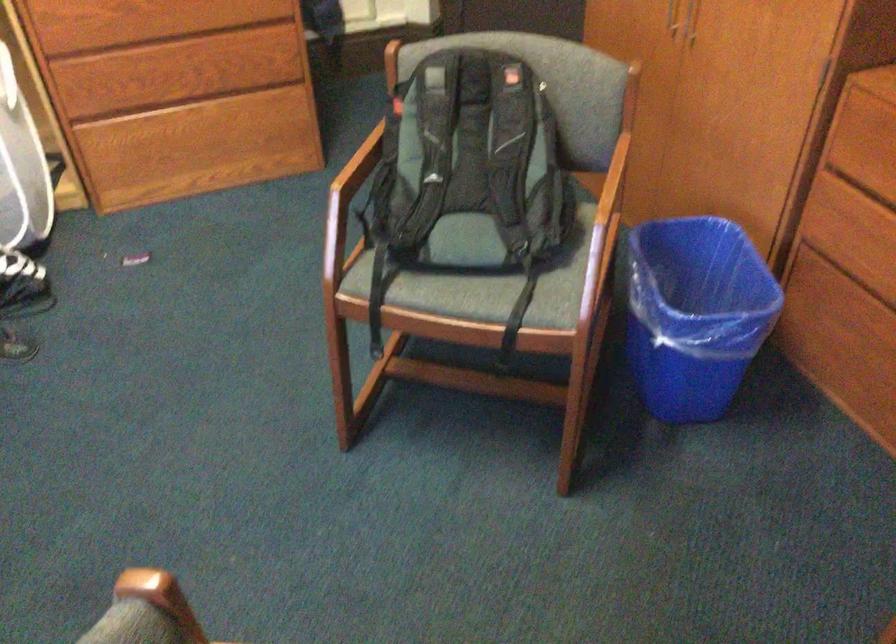
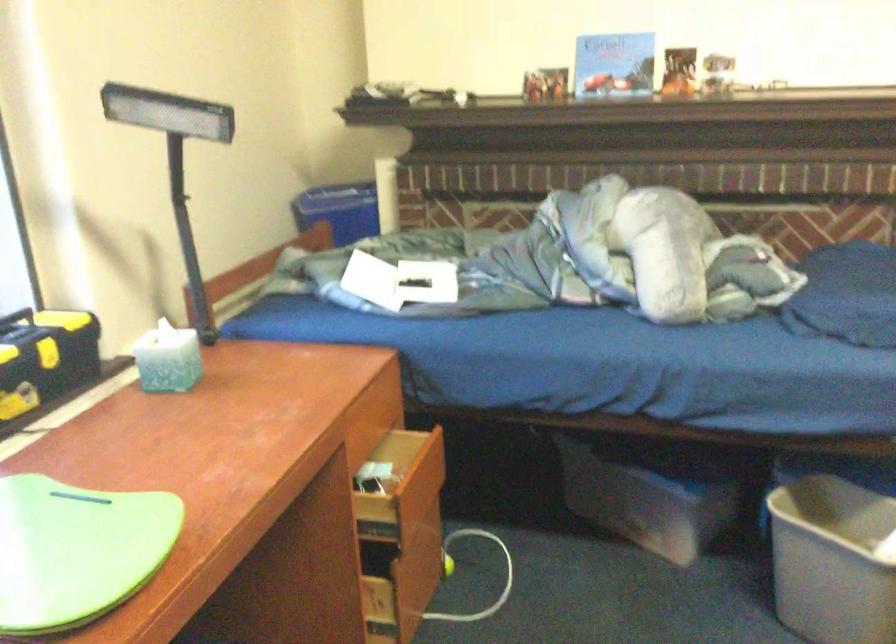
Question: The images are taken continuously from a first-person perspective. In which direction is your viewpoint rotating?

Choices:
 (A) Left
 (B) Right
 (C) Up
 (D) Down

Answer: (A)